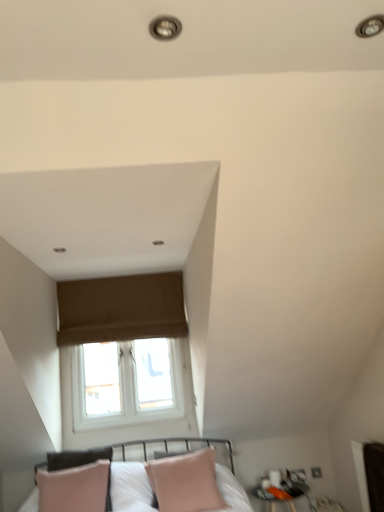
Question: Does matte black side table at lower right have a lesser width compared to pink leather pillow at lower center?

Choices:
 (A) no
 (B) yes

Answer: (A)

Question: From the image's perspective, is matte black side table at lower right on top of pink leather pillow at lower center?

Choices:
 (A) no
 (B) yes

Answer: (A)

Question: Is matte black side table at lower right closer to camera compared to pink leather pillow at lower center?

Choices:
 (A) no
 (B) yes

Answer: (A)

Question: Is pink leather pillow at lower center inside matte black side table at lower right?

Choices:
 (A) yes
 (B) no

Answer: (B)

Question: Considering the relative sizes of matte black side table at lower right and pink leather pillow at lower center in the image provided, is matte black side table at lower right shorter than pink leather pillow at lower center?

Choices:
 (A) yes
 (B) no

Answer: (A)

Question: Would you say pink leather pillow at lower center is to the left or to the right of brown fabric window at upper center in the picture?

Choices:
 (A) right
 (B) left

Answer: (A)

Question: Is pink leather pillow at lower center inside the boundaries of brown fabric window at upper center, or outside?

Choices:
 (A) outside
 (B) inside

Answer: (A)

Question: Looking at the image, does pink leather pillow at lower center seem bigger or smaller compared to brown fabric window at upper center?

Choices:
 (A) big
 (B) small

Answer: (A)

Question: Considering the positions of point (180, 496) and point (165, 284), is point (180, 496) closer or farther from the camera than point (165, 284)?

Choices:
 (A) closer
 (B) farther

Answer: (A)

Question: Is brown fabric window at upper center in front of or behind pink leather pillow at lower center in the image?

Choices:
 (A) behind
 (B) front

Answer: (A)

Question: From the image's perspective, is brown fabric window at upper center positioned above or below pink leather pillow at lower center?

Choices:
 (A) above
 (B) below

Answer: (A)

Question: Considering the positions of brown fabric window at upper center and pink leather pillow at lower center in the image, is brown fabric window at upper center wider or thinner than pink leather pillow at lower center?

Choices:
 (A) wide
 (B) thin

Answer: (B)

Question: Is brown fabric window at upper center inside or outside of pink leather pillow at lower center?

Choices:
 (A) inside
 (B) outside

Answer: (B)

Question: Looking at the image, does brown fabric window at upper center seem bigger or smaller compared to matte black side table at lower right?

Choices:
 (A) big
 (B) small

Answer: (A)

Question: Is brown fabric window at upper center spatially inside matte black side table at lower right, or outside of it?

Choices:
 (A) outside
 (B) inside

Answer: (A)